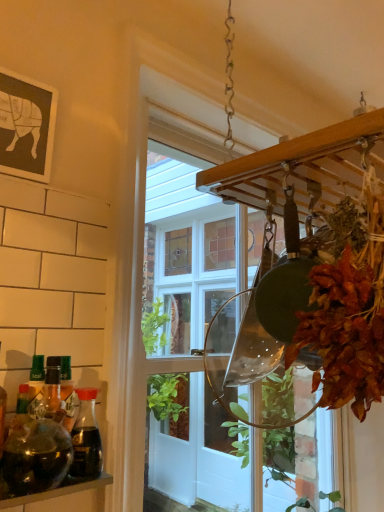
Question: Visually, is clear glass window at center positioned to the left or to the right of transparent glass jar at lower left?

Choices:
 (A) right
 (B) left

Answer: (A)

Question: Do you think clear glass window at center is within transparent glass jar at lower left, or outside of it?

Choices:
 (A) inside
 (B) outside

Answer: (B)

Question: Which is farther from the translucent glass bottle at left, which is the 1th bottle from back to front?

Choices:
 (A) clear glass window at center
 (B) translucent glass bottle at left, which ranks as the 2th bottle in back-to-front order
 (C) transparent glass jar at lower left

Answer: (A)

Question: Estimate the real-world distances between objects in this image. Which object is farther from the translucent glass bottle at left, the second bottle viewed from the front?

Choices:
 (A) transparent glass jar at lower left
 (B) translucent glass bottle at left, the 1th bottle in the front-to-back sequence
 (C) clear glass window at center

Answer: (C)